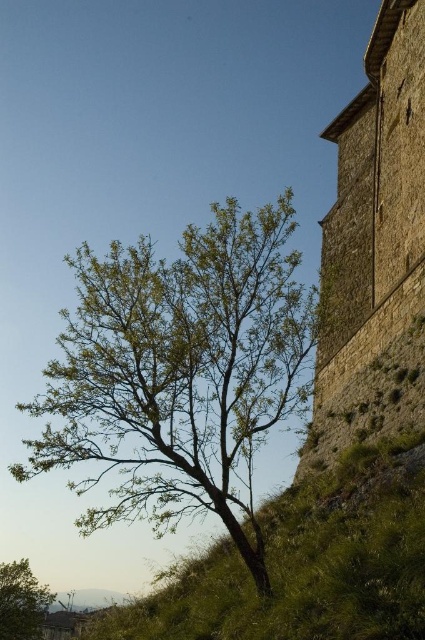
Question: Which object is closer to the camera taking this photo?

Choices:
 (A) green leafy tree at lower left
 (B) brown stone tower at right
 (C) green grassy at lower right
 (D) green leafy tree at center

Answer: (C)

Question: Is green leafy tree at center above brown stone tower at right?

Choices:
 (A) no
 (B) yes

Answer: (A)

Question: Considering the relative positions of green grassy at lower right and green leafy tree at lower left in the image provided, where is green grassy at lower right located with respect to green leafy tree at lower left?

Choices:
 (A) left
 (B) right

Answer: (B)

Question: Among these points, which one is farthest from the camera?

Choices:
 (A) (62, 316)
 (B) (8, 566)

Answer: (B)

Question: Is green leafy tree at center to the left of green leafy tree at lower left from the viewer's perspective?

Choices:
 (A) no
 (B) yes

Answer: (A)

Question: Estimate the real-world distances between objects in this image. Which object is closer to the brown stone tower at right?

Choices:
 (A) green leafy tree at center
 (B) green leafy tree at lower left
 (C) green grassy at lower right

Answer: (A)